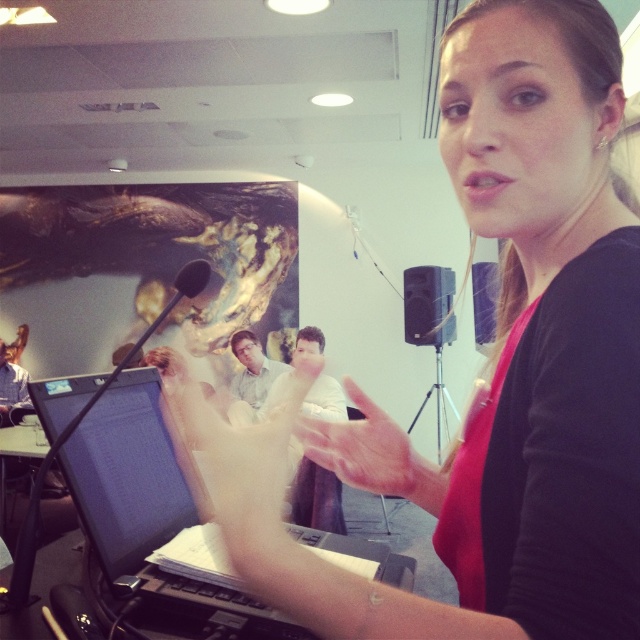
Question: Is matte black speaker at center wider than purple fabric at center?

Choices:
 (A) yes
 (B) no

Answer: (A)

Question: Does matte black speaker at center come in front of purple fabric at center?

Choices:
 (A) yes
 (B) no

Answer: (B)

Question: Which point is closer to the camera?

Choices:
 (A) matte black laptop at center
 (B) matte black speaker at center

Answer: (A)

Question: Estimate the real-world distances between objects in this image. Which object is farther from the purple fabric at center?

Choices:
 (A) matte black laptop at center
 (B) matte black speaker at center

Answer: (A)

Question: Can you confirm if matte black speaker at center is positioned to the right of purple fabric at center?

Choices:
 (A) yes
 (B) no

Answer: (B)

Question: Which object is closer to the camera taking this photo?

Choices:
 (A) purple fabric at center
 (B) matte black speaker at center
 (C) matte black laptop at center

Answer: (C)